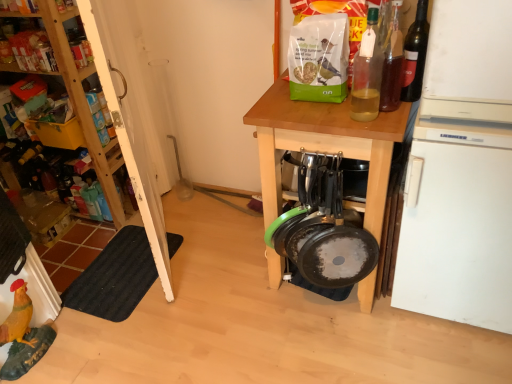
Identify the location of free space in front of black rubber mat at lower left. This screenshot has height=384, width=512. (122, 340).